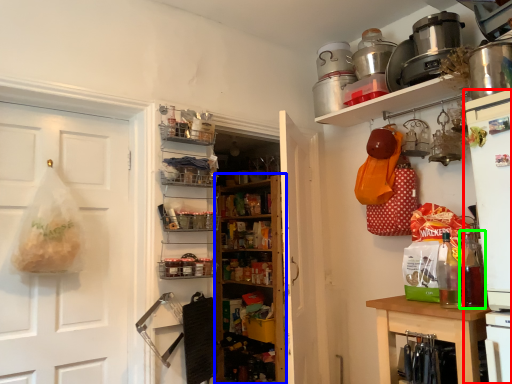
Question: Which object is the farthest from appliance (highlighted by a red box)? Choose among these: bookshelf (highlighted by a blue box) or bottle (highlighted by a green box).

Choices:
 (A) bookshelf
 (B) bottle

Answer: (A)